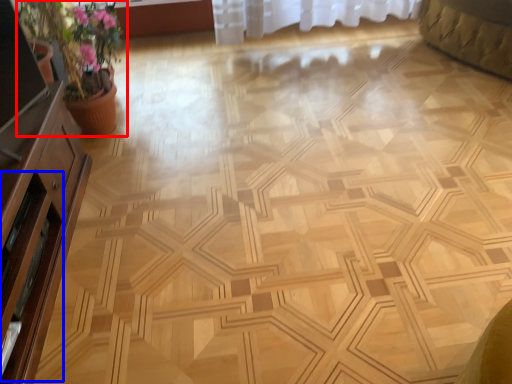
Question: Which object appears farthest to the camera in this image, houseplant (highlighted by a red box) or screen door (highlighted by a blue box)?

Choices:
 (A) houseplant
 (B) screen door

Answer: (A)